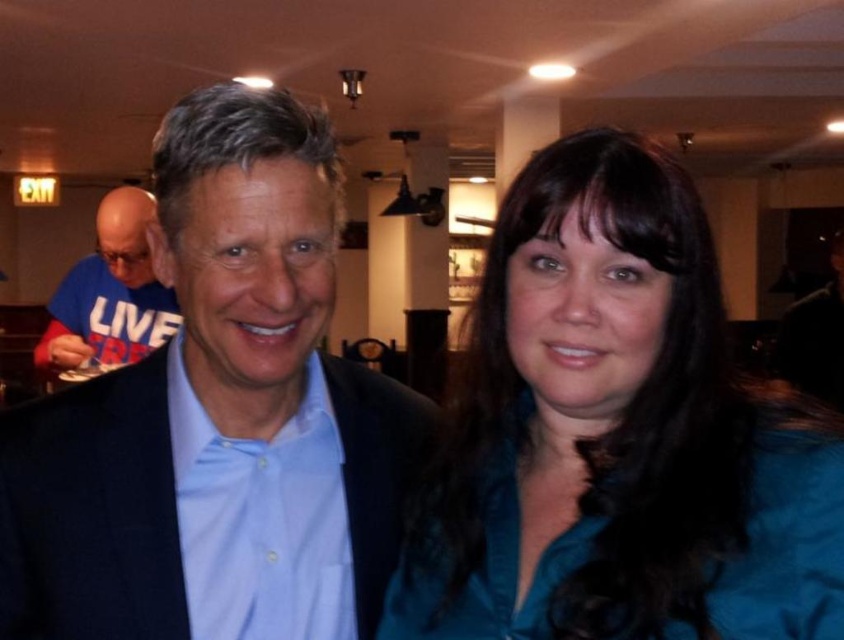
Between matte blue shirt at center and blue t-shirt at left, which one is positioned lower?

Positioned lower is matte blue shirt at center.

Which is more to the right, matte blue shirt at center or blue t-shirt at left?

matte blue shirt at center

Does point (315, 454) come in front of point (123, 211)?

Yes, point (315, 454) is in front of point (123, 211).

What are the coordinates of `matte blue shirt at center` in the screenshot? It's located at (218, 419).

Is point (463, 593) positioned before point (215, 141)?

No, it is behind (215, 141).

Who is more forward, (626, 168) or (164, 282)?

Positioned in front is point (626, 168).

In order to click on teal satin blouse at center in this screenshot , I will do `click(617, 435)`.

Is teal satin blouse at center below blue t-shirt at left?

Yes, teal satin blouse at center is below blue t-shirt at left.

Measure the distance from teal satin blouse at center to blue t-shirt at left.

teal satin blouse at center and blue t-shirt at left are 6.10 feet apart.

You are a GUI agent. You are given a task and a screenshot of the screen. Output one action in this format:
    pyautogui.click(x=<x>, y=<y>)
    Task: Click on the teal satin blouse at center
    This screenshot has width=844, height=640.
    Given the screenshot: What is the action you would take?
    pyautogui.click(x=617, y=435)

In order to click on teal satin blouse at center in this screenshot , I will do `click(617, 435)`.